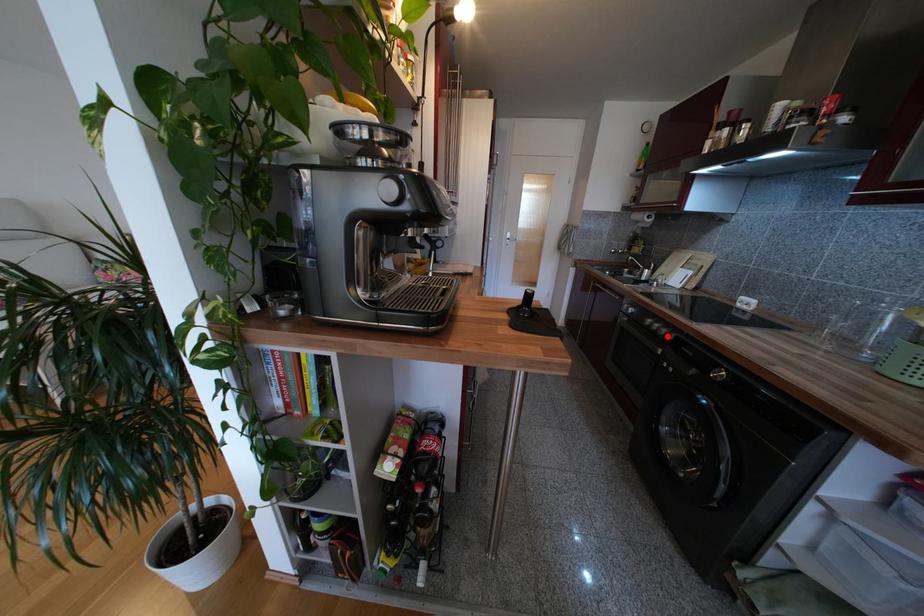
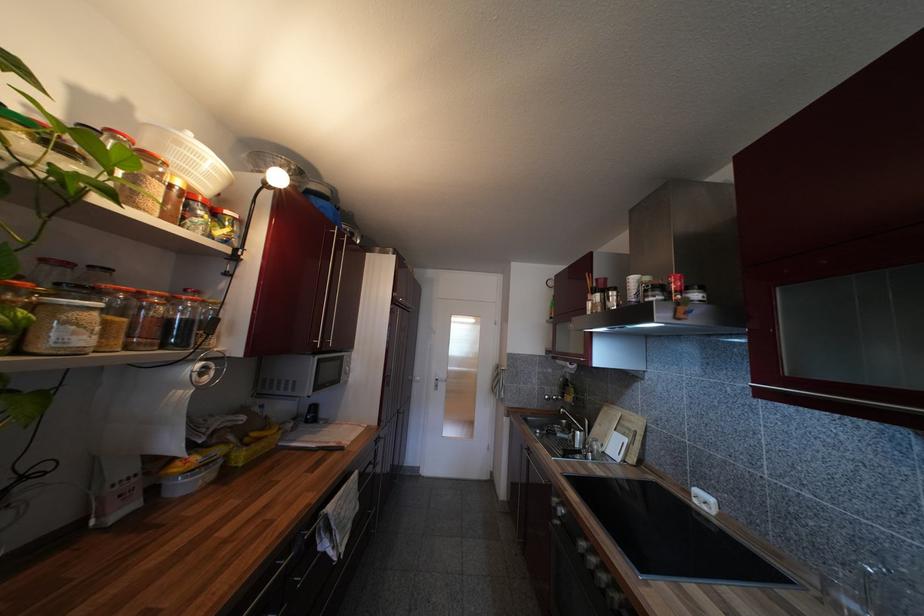
Question: I am providing you with two images of the same scene from different viewpoints. A red point is marked on the first image. Is the red point's position out of view in image 2?

Choices:
 (A) Yes
 (B) No

Answer: (B)